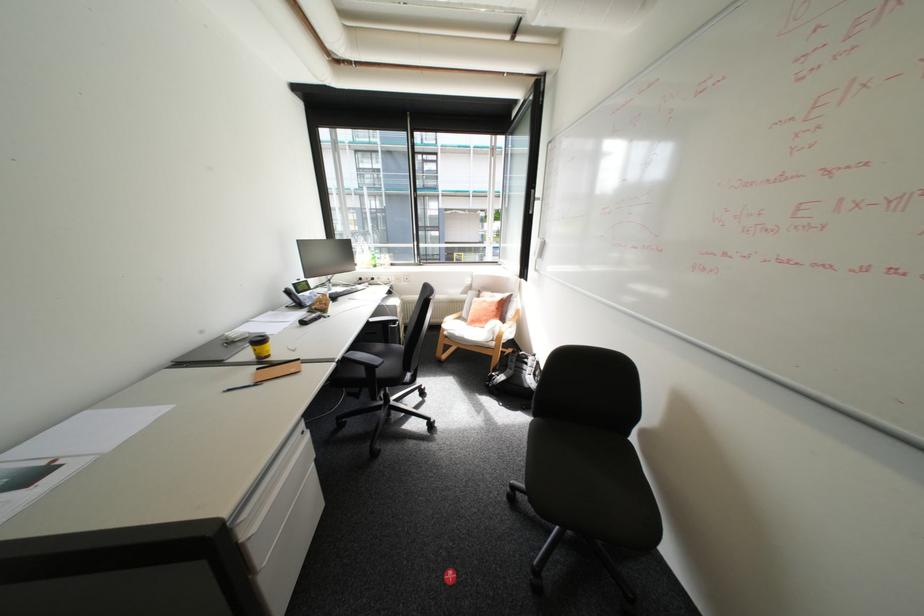
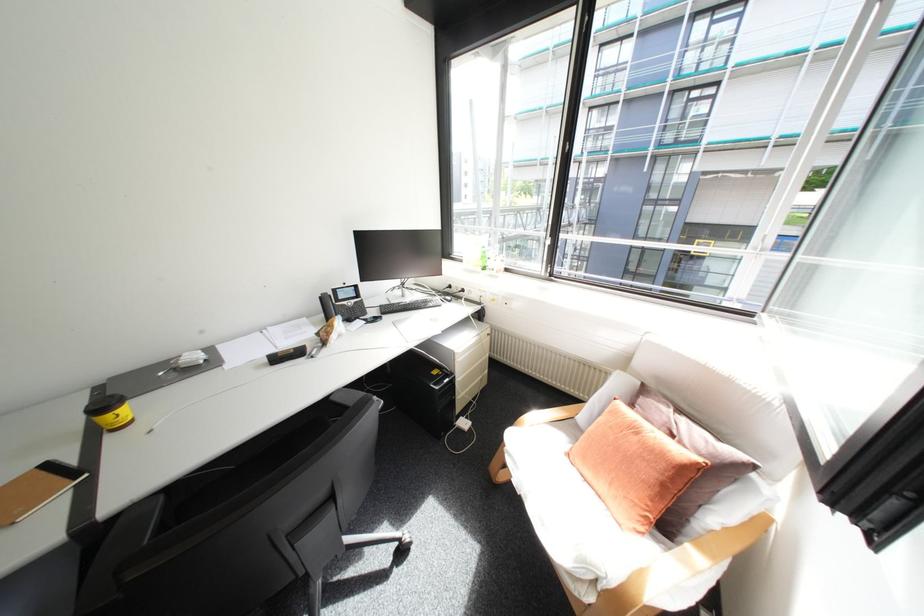
Find the pixel in the second image that matches point 196,367 in the first image.

(103, 397)